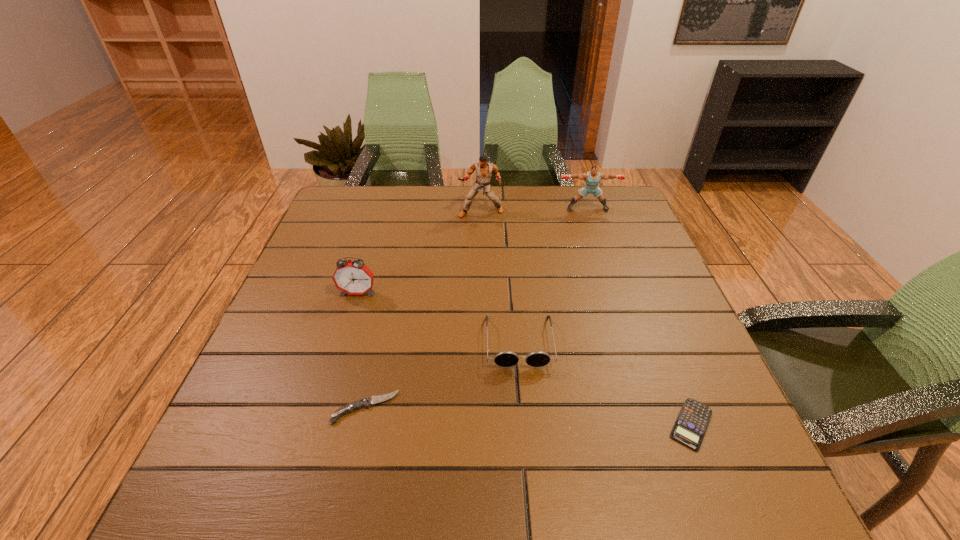
You are a GUI agent. You are given a task and a screenshot of the screen. Output one action in this format:
    pyautogui.click(x=<x>, y=<y>)
    Task: Click on the tallest object
    This screenshot has width=960, height=540.
    Given the screenshot: What is the action you would take?
    pyautogui.click(x=484, y=170)

At what (x,y) coordinates should I click in order to perform the action: click on the taller puncher. Please return your answer as a coordinate pair (x, y). The image size is (960, 540). Looking at the image, I should click on (484, 170).

Where is `the second tallest object`? The width and height of the screenshot is (960, 540). the second tallest object is located at coordinates pos(592,178).

Image resolution: width=960 pixels, height=540 pixels. I want to click on the shorter puncher, so click(592, 178).

Find the location of a particular element. alarm clock is located at coordinates (353, 277).

Where is `the third farthest object`? The width and height of the screenshot is (960, 540). the third farthest object is located at coordinates (353, 277).

Image resolution: width=960 pixels, height=540 pixels. In order to click on sunglasses in this screenshot , I will do `click(505, 358)`.

Where is `the fourth tallest object`? the fourth tallest object is located at coordinates (505, 358).

I want to click on the fifth tallest object, so click(x=366, y=402).

Find the location of `the shortest object`. the shortest object is located at coordinates (690, 427).